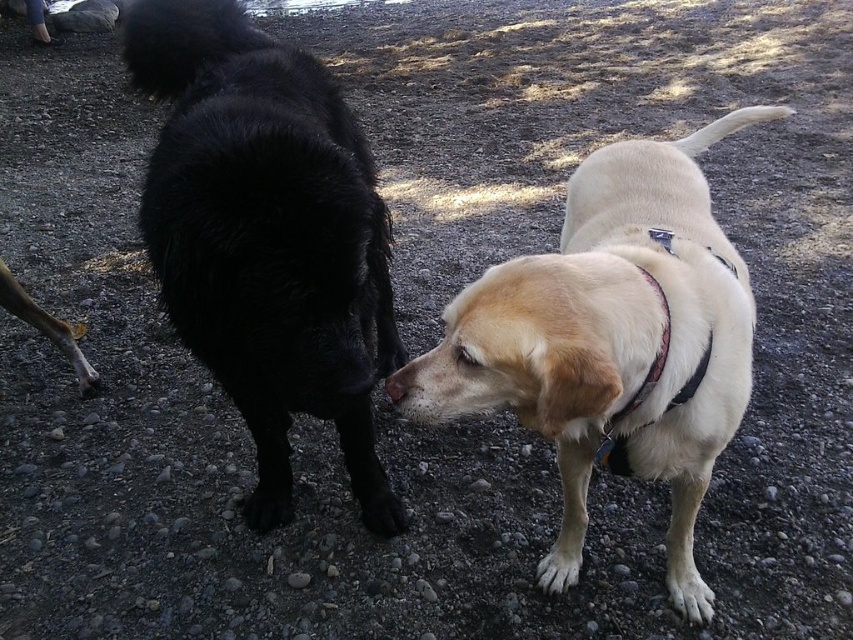
Question: Which of the following is the farthest from the observer?

Choices:
 (A) (468, 353)
 (B) (229, 8)
 (C) (654, 284)
 (D) (32, 12)

Answer: (D)

Question: Which of the following is the closest to the observer?

Choices:
 (A) (254, 76)
 (B) (398, 387)
 (C) (51, 42)

Answer: (B)

Question: Considering the real-world distances, which object is closest to the multicolored fabric neckband at center?

Choices:
 (A) black fluffy dog at left
 (B) brushed metal water at bottle left
 (C) light beige fur at center
 (D) brown matte nose at center

Answer: (C)

Question: Can you confirm if black fluffy dog at left is thinner than multicolored fabric neckband at center?

Choices:
 (A) yes
 (B) no

Answer: (B)

Question: Does multicolored fabric neckband at center lie behind brown matte nose at center?

Choices:
 (A) no
 (B) yes

Answer: (B)

Question: Is multicolored fabric neckband at center smaller than brushed metal water at bottle left?

Choices:
 (A) yes
 (B) no

Answer: (A)